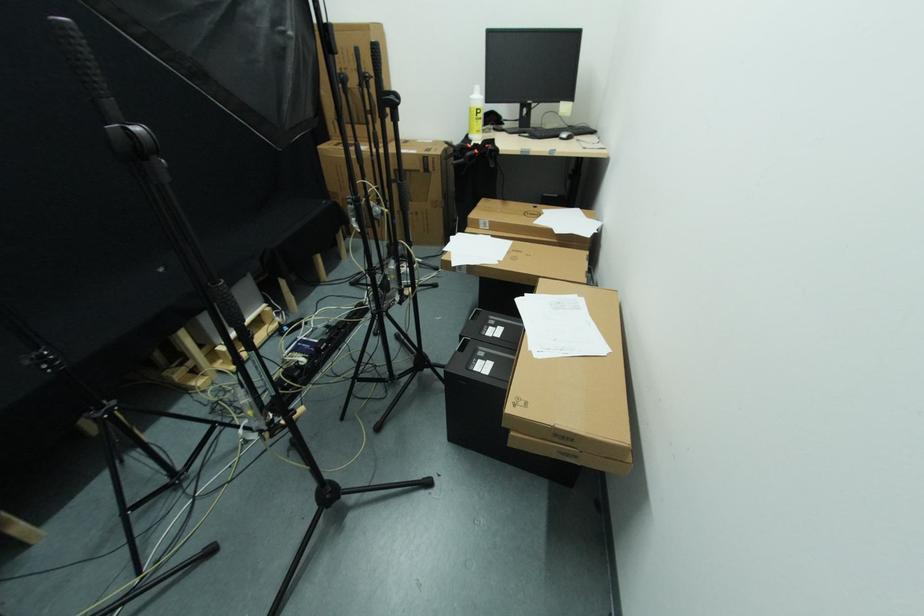
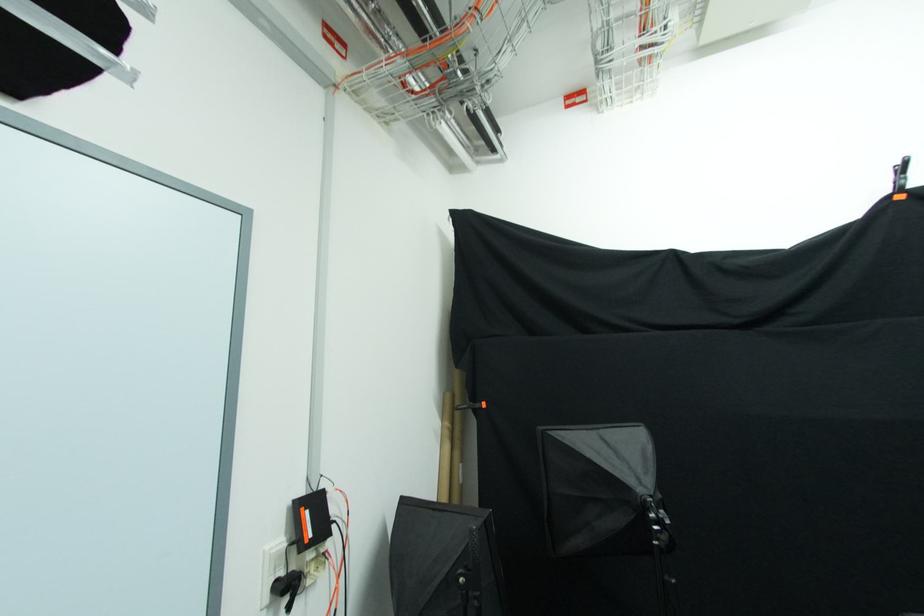
Question: The first image is from the beginning of the video and the second image is from the end. How did the camera likely rotate when shooting the video?

Choices:
 (A) Left
 (B) Right
 (C) Up
 (D) Down

Answer: (A)